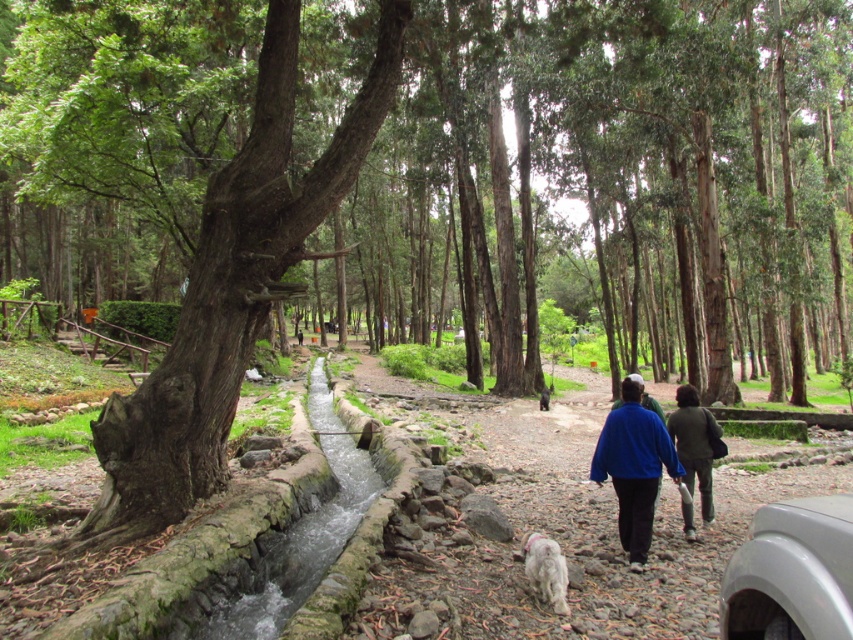
Which is behind, point (115, 13) or point (592, 468)?

Point (115, 13)

Is green rough bark tree at center to the right of blue fleece jacket at center from the viewer's perspective?

Correct, you'll find green rough bark tree at center to the right of blue fleece jacket at center.

Locate an element on the screen. green rough bark tree at center is located at coordinates (635, 173).

Can you confirm if gray matte car at lower right is taller than blue fleece jacket at center?

No.

What do you see at coordinates (792, 572) in the screenshot?
I see `gray matte car at lower right` at bounding box center [792, 572].

The image size is (853, 640). In order to click on gray matte car at lower right in this screenshot , I will do `click(792, 572)`.

Who is more forward, (637, 472) or (554, 611)?

Positioned in front is point (554, 611).

What do you see at coordinates (634, 467) in the screenshot?
I see `blue fleece jacket at center` at bounding box center [634, 467].

Who is more forward, (651, 532) or (525, 566)?

Point (525, 566)

Find the location of a particular element. This screenshot has width=853, height=640. blue fleece jacket at center is located at coordinates (634, 467).